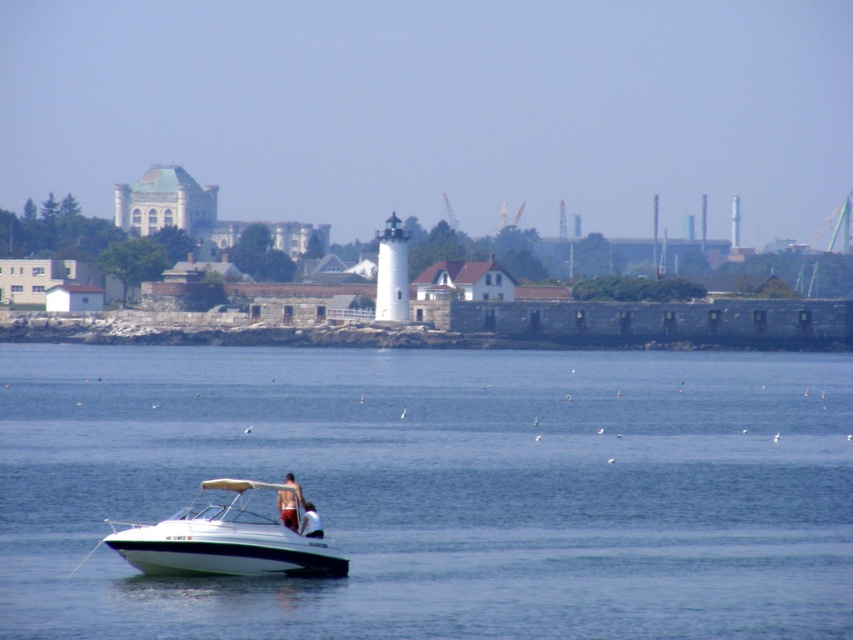
Question: Does white glossy boat at lower left have a greater width compared to skinny jeans at lower center?

Choices:
 (A) no
 (B) yes

Answer: (A)

Question: Which point is farther to the camera?

Choices:
 (A) (291, 365)
 (B) (316, 524)
 (C) (329, 563)
 (D) (286, 509)

Answer: (A)

Question: Is white glossy boat at lower left to the left of skinny jeans at lower center from the viewer's perspective?

Choices:
 (A) yes
 (B) no

Answer: (A)

Question: Can you confirm if tan skin human at lower center is positioned to the left of skinny jeans at lower center?

Choices:
 (A) yes
 (B) no

Answer: (A)

Question: Which of the following is the farthest from the observer?

Choices:
 (A) (323, 468)
 (B) (297, 525)
 (C) (169, 563)

Answer: (A)

Question: Which of the following is the farthest from the observer?

Choices:
 (A) (286, 513)
 (B) (405, 435)
 (C) (309, 504)

Answer: (B)